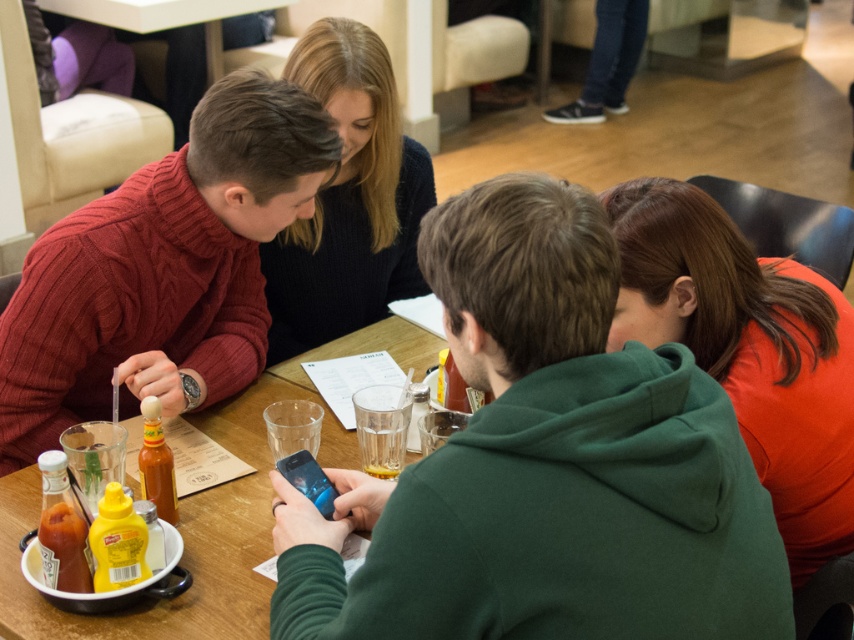
Question: Is the position of yellow matte mustard at lower left more distant than that of yellow plastic mustard bottle at lower left?

Choices:
 (A) no
 (B) yes

Answer: (A)

Question: Can you confirm if orange matte shirt at lower right is wider than translucent plastic bottle at center?

Choices:
 (A) no
 (B) yes

Answer: (B)

Question: Which of the following is the farthest from the observer?

Choices:
 (A) yellow matte mustard at lower left
 (B) translucent glass at center
 (C) translucent plastic bottle at center

Answer: (B)

Question: Which is farther from the translucent glass at center?

Choices:
 (A) orange matte shirt at lower right
 (B) yellow plastic mustard bottle at lower left
 (C) cable-knit sweater at left
 (D) knitted dark blue sweater at upper center

Answer: (D)

Question: Can you confirm if orange matte shirt at lower right is positioned below translucent plastic bottle at center?

Choices:
 (A) no
 (B) yes

Answer: (A)

Question: Which object is the farthest from the orange matte shirt at lower right?

Choices:
 (A) wooden table at center
 (B) yellow matte mustard at lower left
 (C) translucent glass at center

Answer: (B)